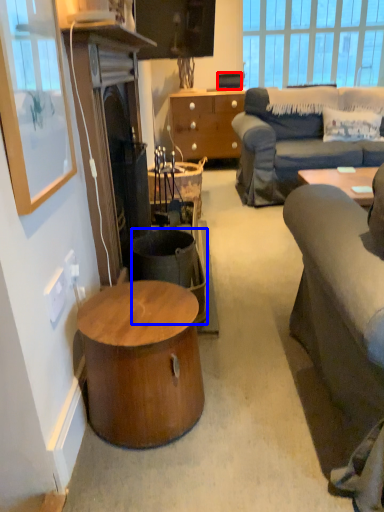
Question: Which of the following is the closest to the observer, speaker (highlighted by a red box) or trash bin/can (highlighted by a blue box)?

Choices:
 (A) speaker
 (B) trash bin/can

Answer: (B)